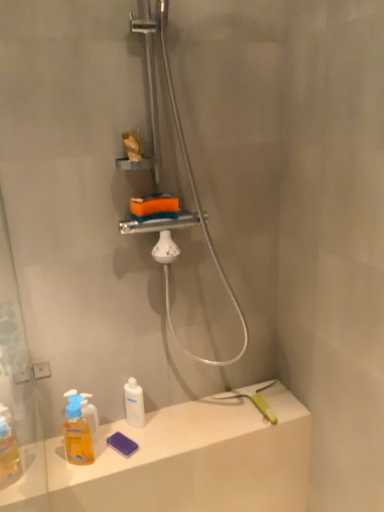
The height and width of the screenshot is (512, 384). In order to click on vacant space positioned to the left of white glossy bottle at lower center, the first mouthwash from the right in this screenshot , I will do `click(91, 448)`.